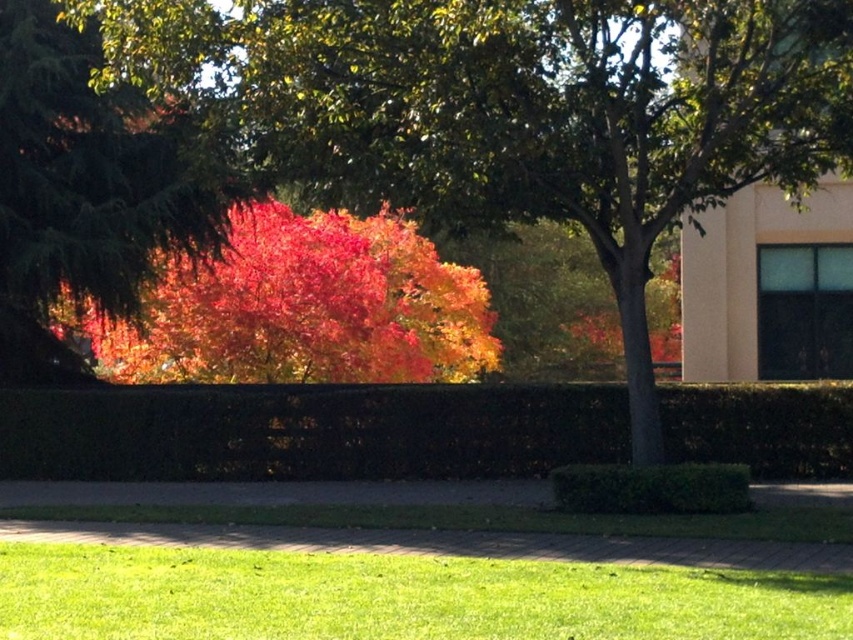
Between green leafy hedge at center and vivid red leaves at upper left, which one is positioned lower?

green leafy hedge at center is below.

Can you confirm if green leafy hedge at center is smaller than vivid red leaves at upper left?

Correct, green leafy hedge at center occupies less space than vivid red leaves at upper left.

Is point (589, 420) closer to viewer compared to point (469, 298)?

Yes, point (589, 420) is closer to viewer.

Find the location of a particular element. green leafy hedge at center is located at coordinates (309, 429).

Measure the distance between green grass at lower left and camera.

green grass at lower left is 9.90 meters away from camera.

Based on the photo, between green grass at lower left and vivid red leaves at upper left, which one has less height?

Standing shorter between the two is green grass at lower left.

Identify the location of green grass at lower left. The width and height of the screenshot is (853, 640). (395, 596).

Can you confirm if autumn leaves at center is positioned below vivid red leaves at left?

Incorrect, autumn leaves at center is not positioned below vivid red leaves at left.

Between point (538, 132) and point (47, 0), which one is positioned behind?

The point (47, 0) is more distant.

Image resolution: width=853 pixels, height=640 pixels. Find the location of `autumn leaves at center`. autumn leaves at center is located at coordinates (515, 109).